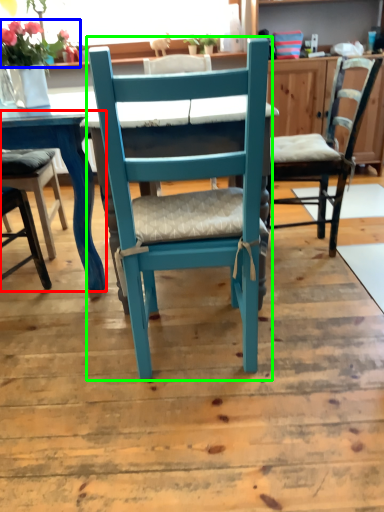
Question: Which is farther away from table (highlighted by a red box)? flower (highlighted by a blue box) or chair (highlighted by a green box)?

Choices:
 (A) flower
 (B) chair

Answer: (B)